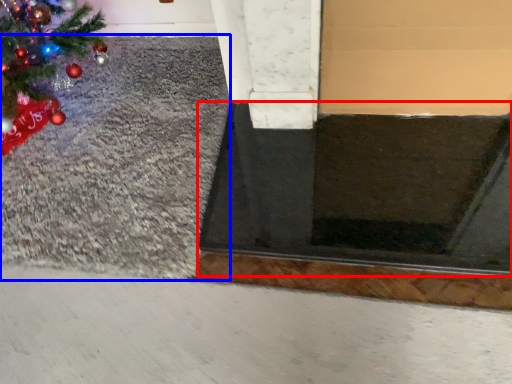
Question: Which object is further to the camera taking this photo, doormat (highlighted by a red box) or gravel (highlighted by a blue box)?

Choices:
 (A) doormat
 (B) gravel

Answer: (B)